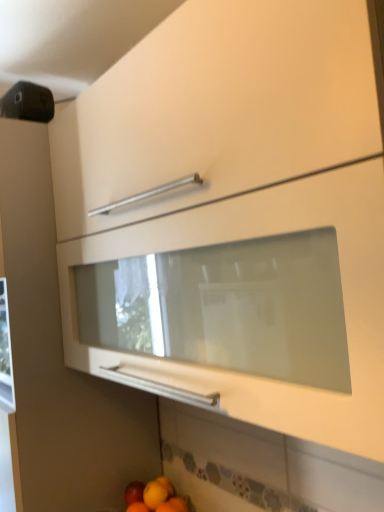
Question: From the image's perspective, is matte red apple at lower left above matte orange at lower center?

Choices:
 (A) no
 (B) yes

Answer: (A)

Question: Can you confirm if matte red apple at lower left is shorter than matte orange at lower center?

Choices:
 (A) no
 (B) yes

Answer: (B)

Question: Is matte red apple at lower left to the right of matte orange at lower center from the viewer's perspective?

Choices:
 (A) yes
 (B) no

Answer: (B)

Question: Is matte red apple at lower left completely or partially outside of matte orange at lower center?

Choices:
 (A) no
 (B) yes

Answer: (B)

Question: From the image's perspective, does matte red apple at lower left appear lower than matte orange at lower center?

Choices:
 (A) yes
 (B) no

Answer: (A)

Question: From a real-world perspective, is matte red apple at lower left below matte orange at lower center?

Choices:
 (A) no
 (B) yes

Answer: (B)

Question: Is matte orange at lower center bigger than matte red apple at lower left?

Choices:
 (A) no
 (B) yes

Answer: (B)

Question: Is matte orange at lower center facing towards matte red apple at lower left?

Choices:
 (A) yes
 (B) no

Answer: (B)

Question: Considering the relative positions of matte orange at lower center and matte red apple at lower left in the image provided, is matte orange at lower center to the right of matte red apple at lower left from the viewer's perspective?

Choices:
 (A) no
 (B) yes

Answer: (B)

Question: Can you confirm if matte orange at lower center is taller than matte red apple at lower left?

Choices:
 (A) yes
 (B) no

Answer: (A)

Question: Considering the relative sizes of matte orange at lower center and matte red apple at lower left in the image provided, is matte orange at lower center wider than matte red apple at lower left?

Choices:
 (A) no
 (B) yes

Answer: (B)

Question: From a real-world perspective, is matte orange at lower center positioned over matte red apple at lower left based on gravity?

Choices:
 (A) yes
 (B) no

Answer: (A)

Question: Is matte orange at lower center taller or shorter than matte red apple at lower left?

Choices:
 (A) tall
 (B) short

Answer: (A)